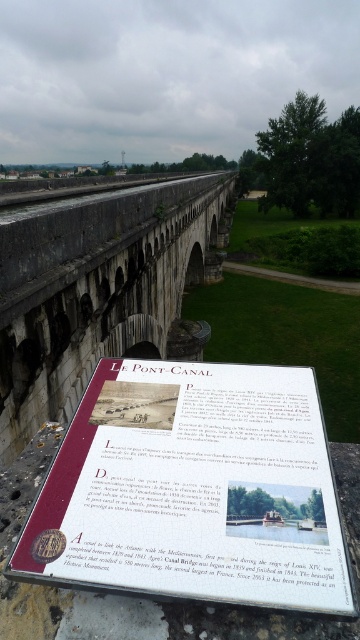
Between point (212, 435) and point (191, 356), which one is positioned behind?

The point (191, 356) is more distant.

Is point (95, 451) positioned before point (15, 456)?

Yes, point (95, 451) is closer to viewer.

The image size is (360, 640). Find the location of `white paper sign at center`. white paper sign at center is located at coordinates (194, 490).